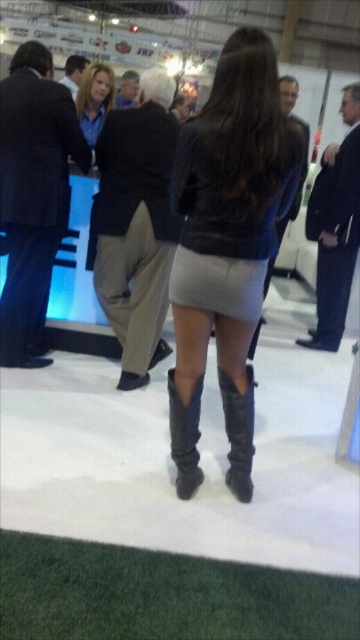
Question: Which object is positioned closest to the light gray leather skirt at center?

Choices:
 (A) leather boots at center
 (B) leather jacket at center
 (C) leather at center

Answer: (B)

Question: Is light gray leather skirt at center further to camera compared to leather boots at center?

Choices:
 (A) yes
 (B) no

Answer: (B)

Question: Estimate the real-world distances between objects in this image. Which object is closer to the leather at center?

Choices:
 (A) light gray leather skirt at center
 (B) leather jacket at center
 (C) leather boots at center

Answer: (C)

Question: Which object is positioned closest to the light gray leather skirt at center?

Choices:
 (A) leather boots at center
 (B) leather at center
 (C) leather jacket at center

Answer: (C)

Question: Is leather jacket at center to the left of light gray leather skirt at center from the viewer's perspective?

Choices:
 (A) no
 (B) yes

Answer: (B)

Question: Where is leather jacket at center located in relation to light gray leather skirt at center in the image?

Choices:
 (A) left
 (B) right

Answer: (A)